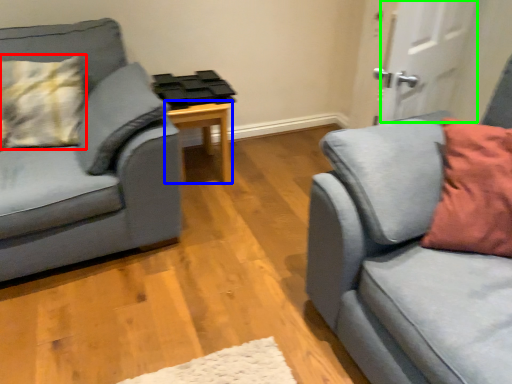
Question: Estimate the real-world distances between objects in this image. Which object is farther from pillow (highlighted by a red box), table (highlighted by a blue box) or door (highlighted by a green box)?

Choices:
 (A) table
 (B) door

Answer: (B)